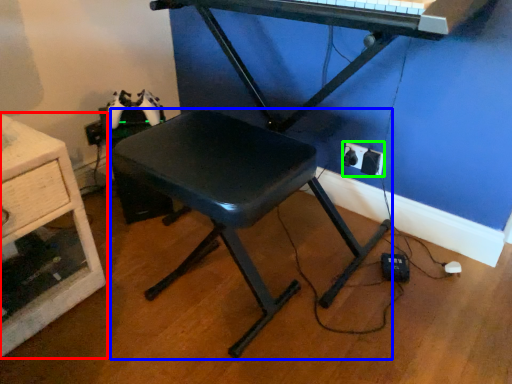
Question: Which object is the farthest from furniture (highlighted by a red box)? Choose among these: stool (highlighted by a blue box) or electric outlet (highlighted by a green box).

Choices:
 (A) stool
 (B) electric outlet

Answer: (B)